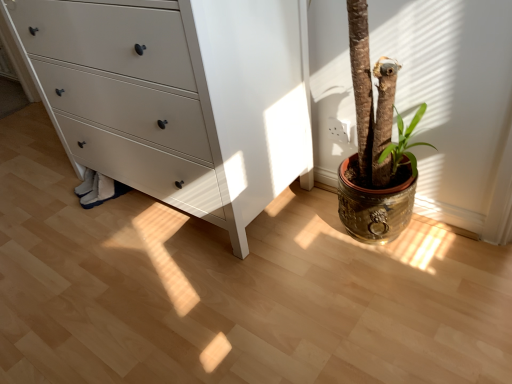
This screenshot has height=384, width=512. In order to click on white matte chest of drawers at left in this screenshot , I will do (179, 96).

What is the approximate width of white matte chest of drawers at left?

The width of white matte chest of drawers at left is 20.27 inches.

What do you see at coordinates (179, 96) in the screenshot? I see `white matte chest of drawers at left` at bounding box center [179, 96].

Where is `white matte chest of drawers at left`? This screenshot has height=384, width=512. white matte chest of drawers at left is located at coordinates (179, 96).